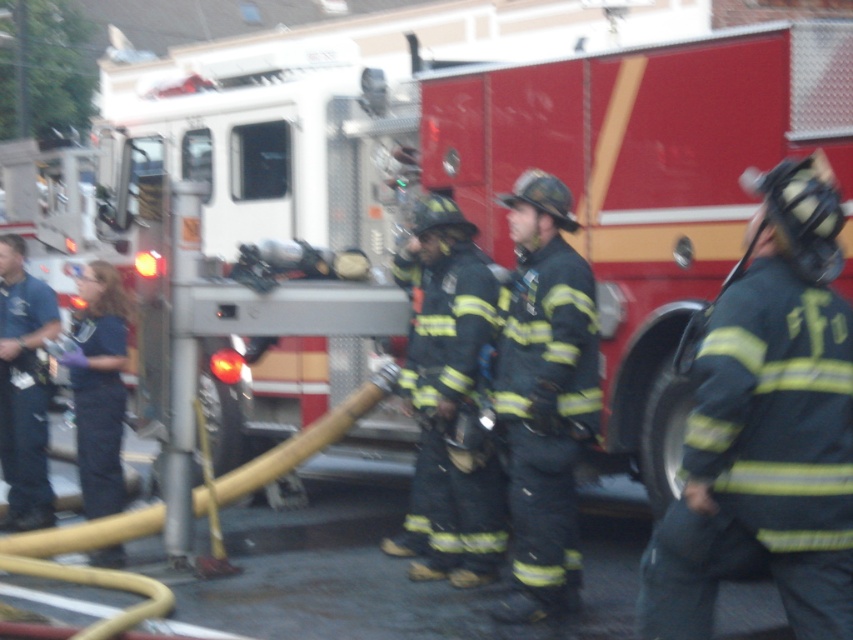
Question: Does dark blue uniform at center have a smaller size compared to black matte uniform at center?

Choices:
 (A) no
 (B) yes

Answer: (B)

Question: Observing the image, what is the correct spatial positioning of dark gray uniform at center in reference to black matte uniform at center?

Choices:
 (A) above
 (B) below

Answer: (A)

Question: Which of these objects is positioned farthest from the dark blue uniform at center?

Choices:
 (A) dark gray uniform at center
 (B) black matte uniform at center

Answer: (A)

Question: Which object is closer to the camera taking this photo?

Choices:
 (A) dark blue uniform at center
 (B) dark gray uniform at center

Answer: (B)

Question: Which object is positioned closest to the dark blue uniform at center?

Choices:
 (A) dark gray uniform at center
 (B) black matte uniform at center

Answer: (B)

Question: Does dark gray uniform at center come behind dark blue uniform at center?

Choices:
 (A) no
 (B) yes

Answer: (A)